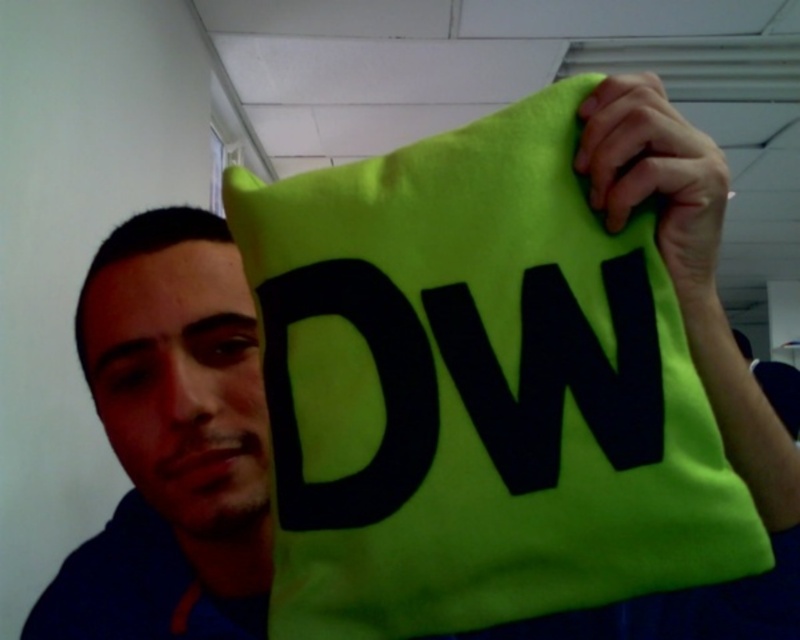
From the picture: You are organizing a photo shoot and need to ensure that the neon green fabric pillow at upper right and the matte blue shirt at left are positioned correctly. Based on their sizes, which object should be placed closer to the camera to avoid appearing too small in the frame?

The neon green fabric pillow at upper right is shorter than the matte blue shirt at left, so to avoid it appearing too small, the neon green fabric pillow at upper right should be placed closer to the camera.

You are designing a display for a store window and need to arrange the neon green fabric pillow at upper right and the matte blue shirt at left. Which object should you place first if you want the wider item to be positioned centrally?

The neon green fabric pillow at upper right should be placed first because it is wider than the matte blue shirt at left, so centering it would ensure proper alignment.